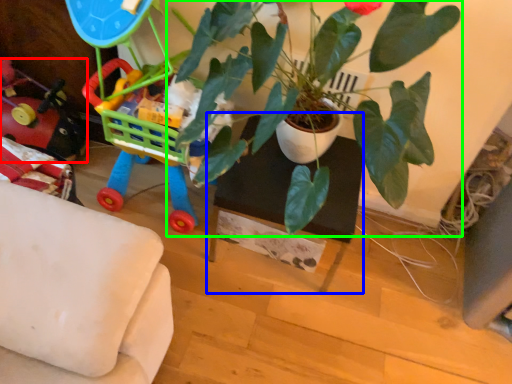
Question: Based on their relative distances, which object is farther from toy (highlighted by a red box)? Choose from table (highlighted by a blue box) and houseplant (highlighted by a green box).

Choices:
 (A) table
 (B) houseplant

Answer: (B)